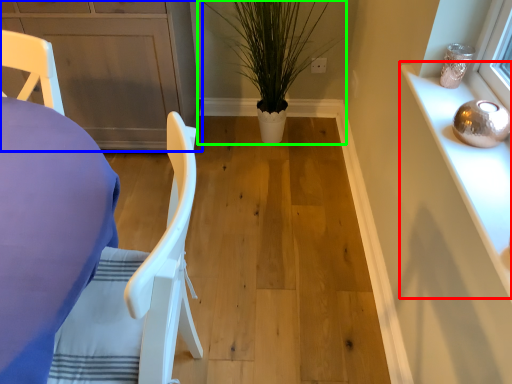
Question: Considering the real-world distances, which object is closest to cabinetry (highlighted by a red box)? cabinetry (highlighted by a blue box) or houseplant (highlighted by a green box).

Choices:
 (A) cabinetry
 (B) houseplant

Answer: (B)